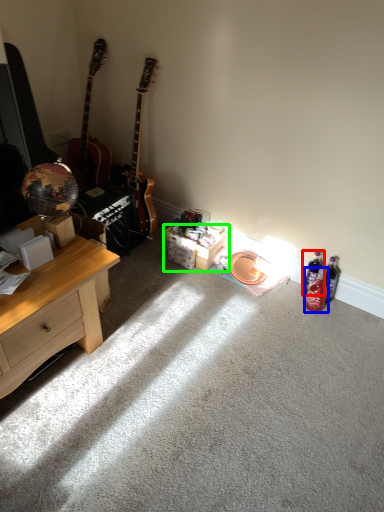
Question: Which object is positioned closest to bottle (highlighted by a red box)? Select from bottle (highlighted by a blue box) and box (highlighted by a green box).

Choices:
 (A) bottle
 (B) box

Answer: (A)